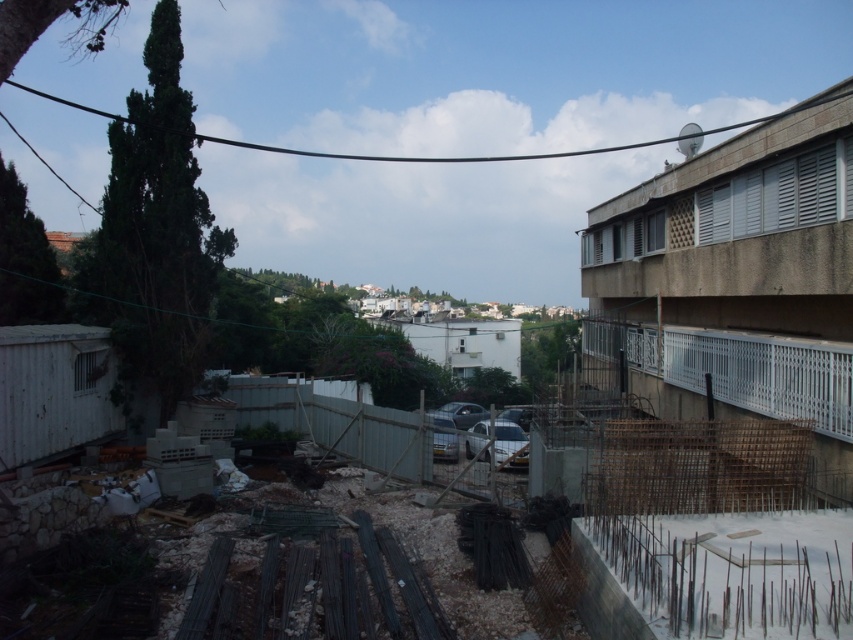
You are a delivery person trying to park your shiny silver car at center near the white metal fence at right. Considering the height of the fence, do you think your car will be visible from the street?

The white metal fence at right is much taller than the shiny silver car at center, so the car will be mostly hidden from the street view due to the fence height.

You are a delivery person who needs to park your van in this area. The van is 6 meters long. There is a white glossy car at center and a shiny silver car at center. Can you fit your van between them without moving any cars?

The distance between the white glossy car at center and the shiny silver car at center is 14.31 meters. Since your van is only 6 meters long, you can easily fit it between them without moving any cars.

You are a delivery person needing to access the white glossy car at center and the shiny silver car at center parked at the construction site. Which car is closer to you as you approach the site from the front?

The white glossy car at center is closer to you because it is in front of the shiny silver car at center.